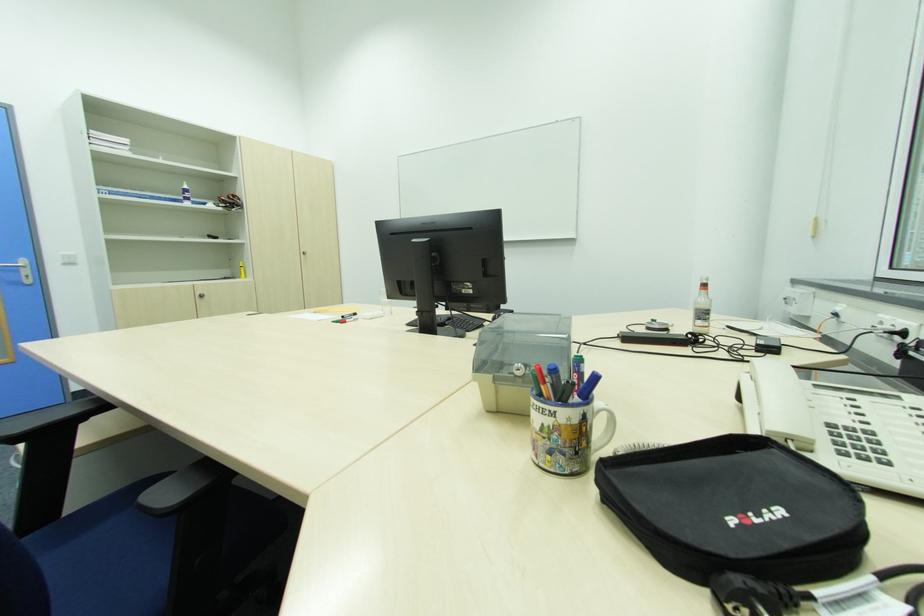
Where would you lift the mug handle? Please return your answer as a coordinate pair (x, y).

(603, 427)